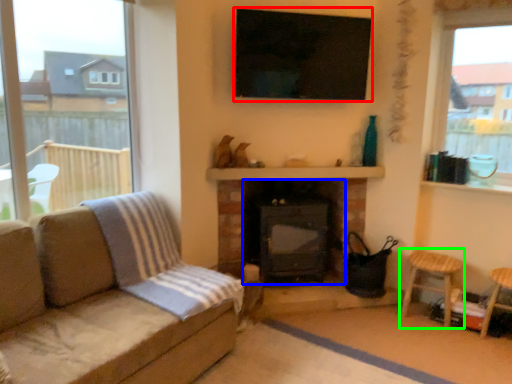
Question: Which object is the farthest from window screen (highlighted by a red box)? Choose among these: fireplace (highlighted by a blue box) or bar stool (highlighted by a green box).

Choices:
 (A) fireplace
 (B) bar stool

Answer: (B)